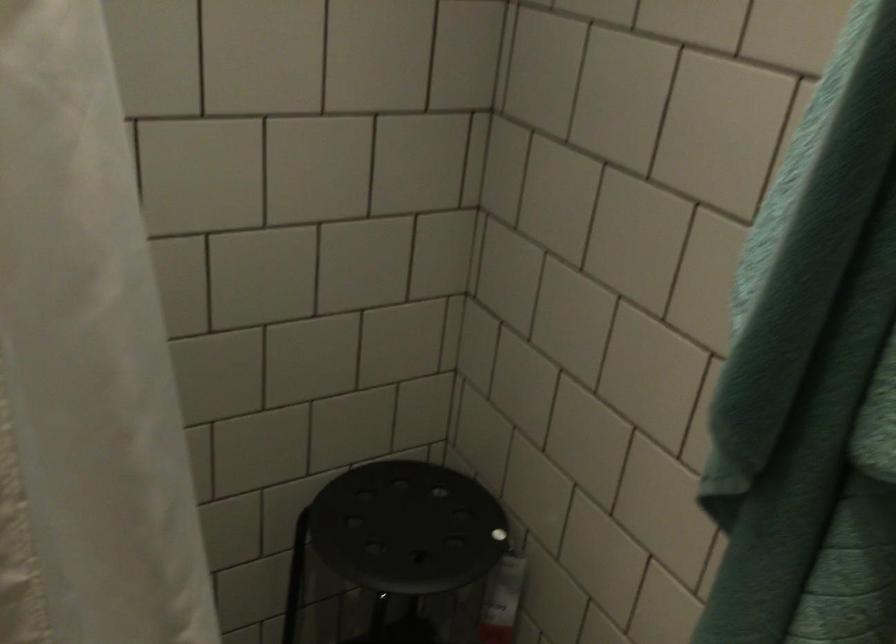
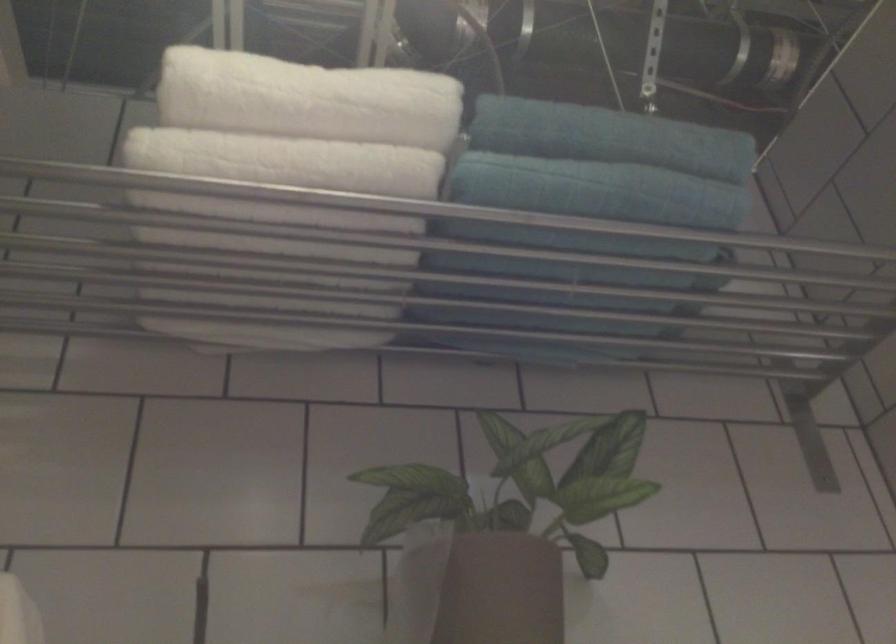
The images are taken continuously from a first-person perspective. In which direction is your viewpoint rotating?

The camera rotated toward left-up.